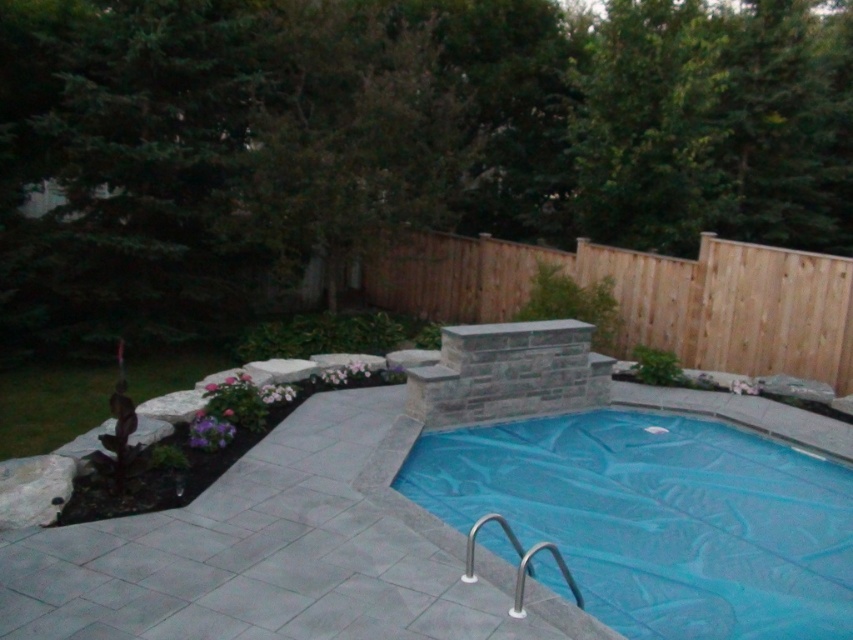
From the picture: Is blue plastic pool at center bigger than brown wood fence at center?

Correct, blue plastic pool at center is larger in size than brown wood fence at center.

Between point (694, 602) and point (726, 253), which one is positioned behind?

Point (726, 253)

The image size is (853, 640). Describe the element at coordinates (659, 518) in the screenshot. I see `blue plastic pool at center` at that location.

Locate an element on the screen. blue plastic pool at center is located at coordinates (659, 518).